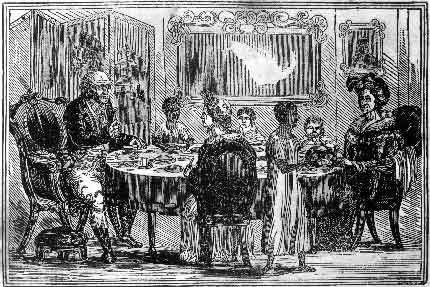
Image resolution: width=430 pixels, height=287 pixels. In order to click on painting frames in this screenshot , I will do `click(315, 96)`, `click(347, 70)`.